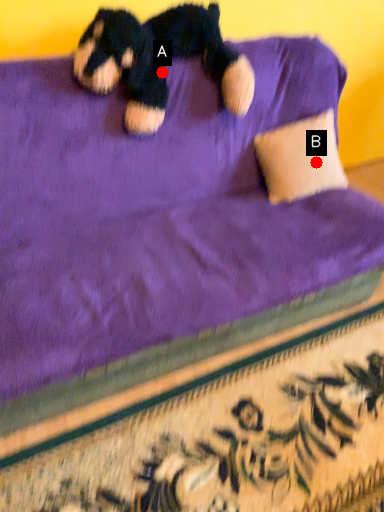
Question: Two points are circled on the image, labeled by A and B beside each circle. Which of the following is the farthest from the observer?

Choices:
 (A) A is further
 (B) B is further

Answer: (B)